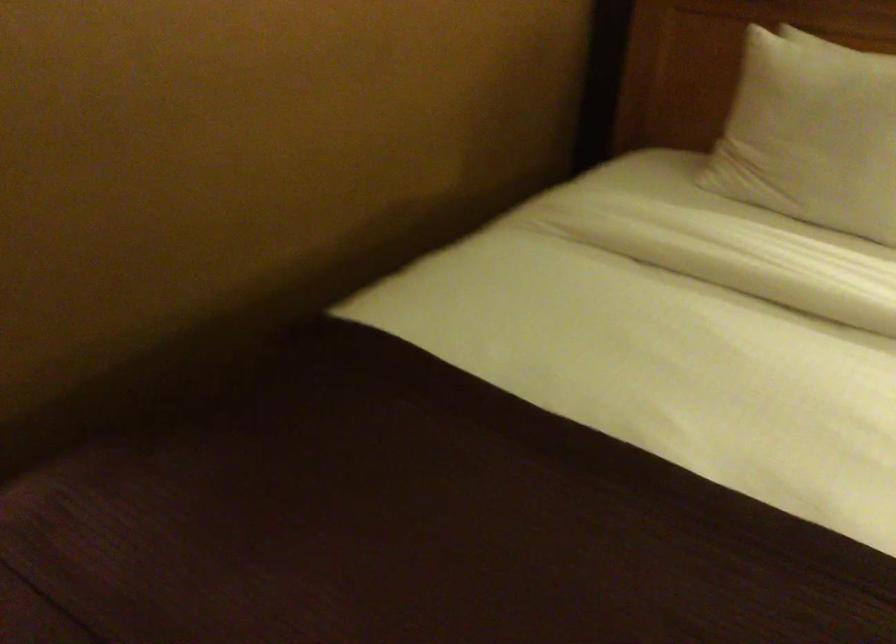
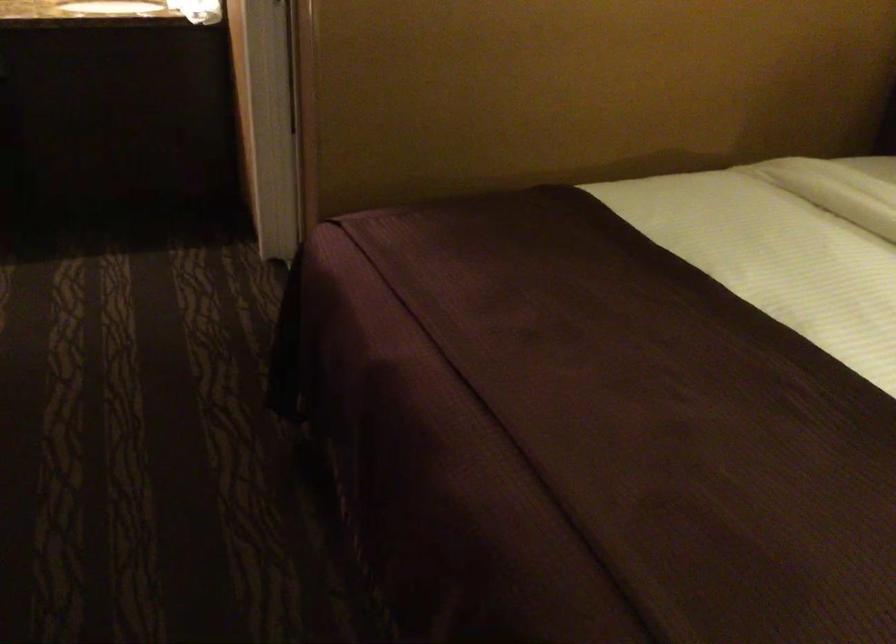
Which direction would the cameraman need to move to produce the second image?

The cameraman moved toward right, backward.